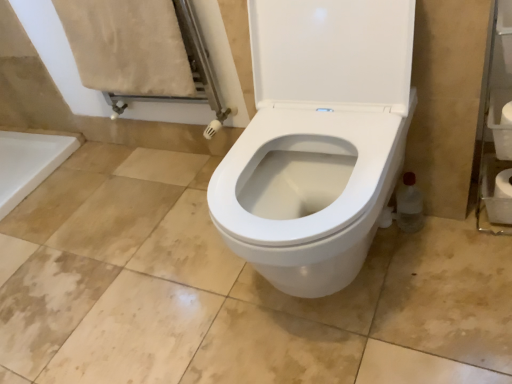
Question: From the image's perspective, is white matte toilet paper at right, the 1th toilet paper in the top-to-bottom sequence, over white matte toilet paper at right, which is the 1th toilet paper in back-to-front order?

Choices:
 (A) yes
 (B) no

Answer: (A)

Question: Is white matte toilet paper at right, the first toilet paper when ordered from front to back, in front of white matte toilet paper at right, which ranks as the 2th toilet paper in front-to-back order?

Choices:
 (A) yes
 (B) no

Answer: (A)

Question: Can you confirm if white matte toilet paper at right, the first toilet paper when ordered from front to back, is shorter than white matte toilet paper at right, which ranks as the first toilet paper in bottom-to-top order?

Choices:
 (A) yes
 (B) no

Answer: (A)

Question: Can you confirm if white matte toilet paper at right, the first toilet paper when ordered from front to back, is wider than white matte toilet paper at right, which is the 1th toilet paper in back-to-front order?

Choices:
 (A) no
 (B) yes

Answer: (A)

Question: From a real-world perspective, is white matte toilet paper at right, acting as the second toilet paper starting from the bottom, below white matte toilet paper at right, which ranks as the 2th toilet paper in front-to-back order?

Choices:
 (A) no
 (B) yes

Answer: (A)

Question: Considering the relative sizes of white matte toilet paper at right, the 1th toilet paper in the top-to-bottom sequence, and white matte toilet paper at right, the 2th toilet paper positioned from the top, in the image provided, is white matte toilet paper at right, the 1th toilet paper in the top-to-bottom sequence, smaller than white matte toilet paper at right, the 2th toilet paper positioned from the top,?

Choices:
 (A) no
 (B) yes

Answer: (B)

Question: Considering the relative sizes of white matte toilet paper at right, which is the 1th toilet paper in back-to-front order, and white matte toilet paper at right, acting as the second toilet paper starting from the bottom, in the image provided, is white matte toilet paper at right, which is the 1th toilet paper in back-to-front order, thinner than white matte toilet paper at right, acting as the second toilet paper starting from the bottom,?

Choices:
 (A) yes
 (B) no

Answer: (B)

Question: From a real-world perspective, is white matte toilet paper at right, the 2th toilet paper positioned from the top, over white matte toilet paper at right, the 1th toilet paper in the top-to-bottom sequence?

Choices:
 (A) yes
 (B) no

Answer: (B)

Question: Is white matte toilet paper at right, which ranks as the first toilet paper in bottom-to-top order, taller than white matte toilet paper at right, the first toilet paper when ordered from front to back?

Choices:
 (A) no
 (B) yes

Answer: (B)

Question: From the image's perspective, is white matte toilet paper at right, the 2th toilet paper positioned from the top, over white matte toilet paper at right, acting as the 2th toilet paper starting from the back?

Choices:
 (A) no
 (B) yes

Answer: (A)

Question: Is the depth of white matte toilet paper at right, which is the 1th toilet paper in back-to-front order, greater than that of white matte toilet paper at right, acting as the 2th toilet paper starting from the back?

Choices:
 (A) no
 (B) yes

Answer: (B)

Question: Is white matte toilet paper at right, which is the 1th toilet paper in back-to-front order, to the left of white matte toilet paper at right, the first toilet paper when ordered from front to back, from the viewer's perspective?

Choices:
 (A) no
 (B) yes

Answer: (A)

Question: Does point (503, 170) appear closer or farther from the camera than point (502, 155)?

Choices:
 (A) farther
 (B) closer

Answer: (A)